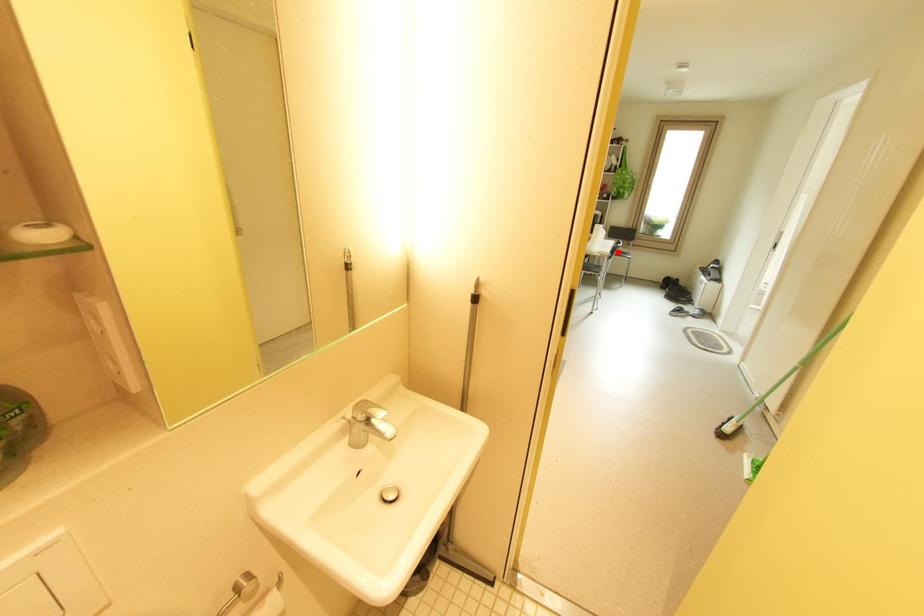
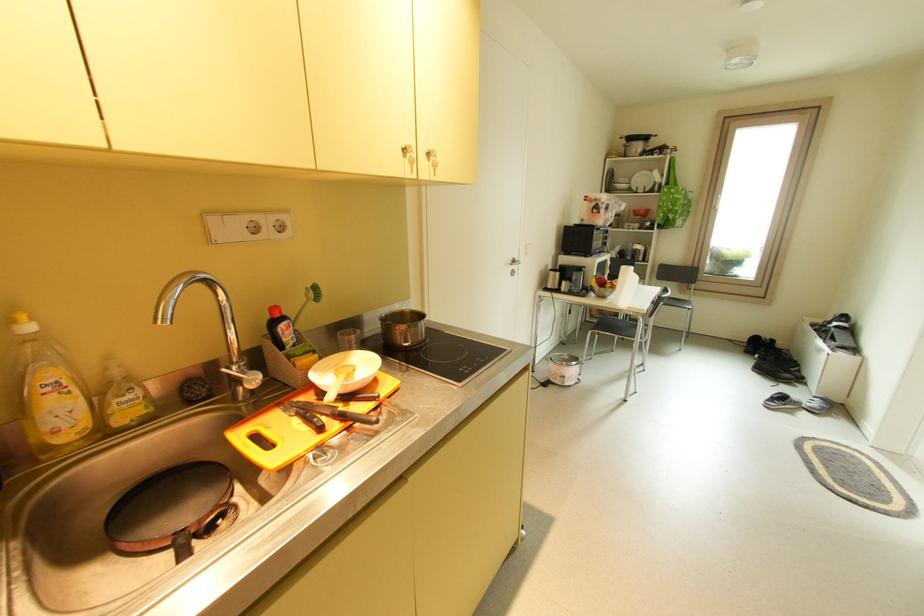
Question: I am providing you with two images of the same scene from different viewpoints. Given a red point in image1, look at the same physical point in image2. Is it:

Choices:
 (A) Closer to the viewpoint
 (B) Farther from the viewpoint

Answer: (B)